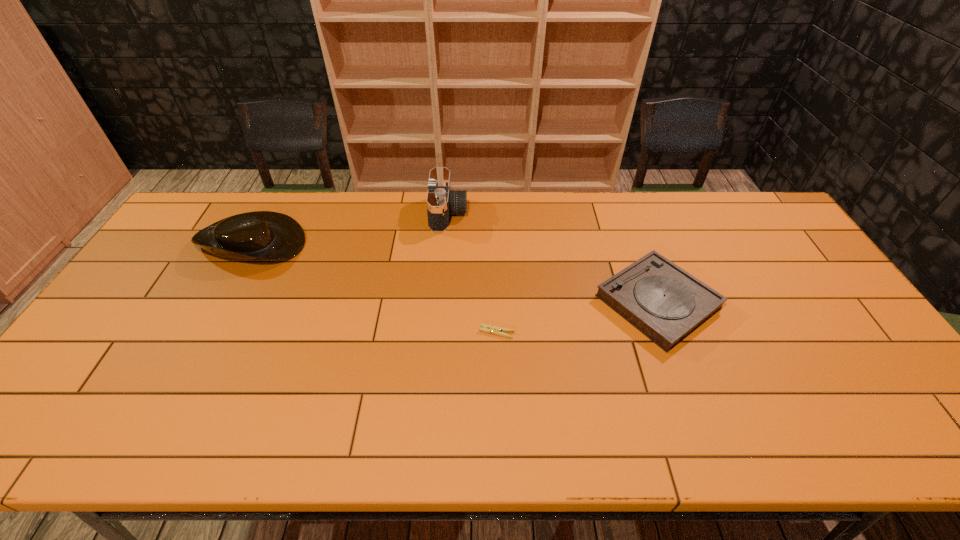
The image size is (960, 540). In order to click on free location that satisfies the following two spatial constraints: 1. on the front side of the leftmost object; 2. on the left side of the third tallest object in this screenshot , I will do `click(219, 302)`.

The image size is (960, 540). I want to click on blank space that satisfies the following two spatial constraints: 1. on the front-facing side of the tallest object; 2. on the left side of the clothespin, so click(x=439, y=332).